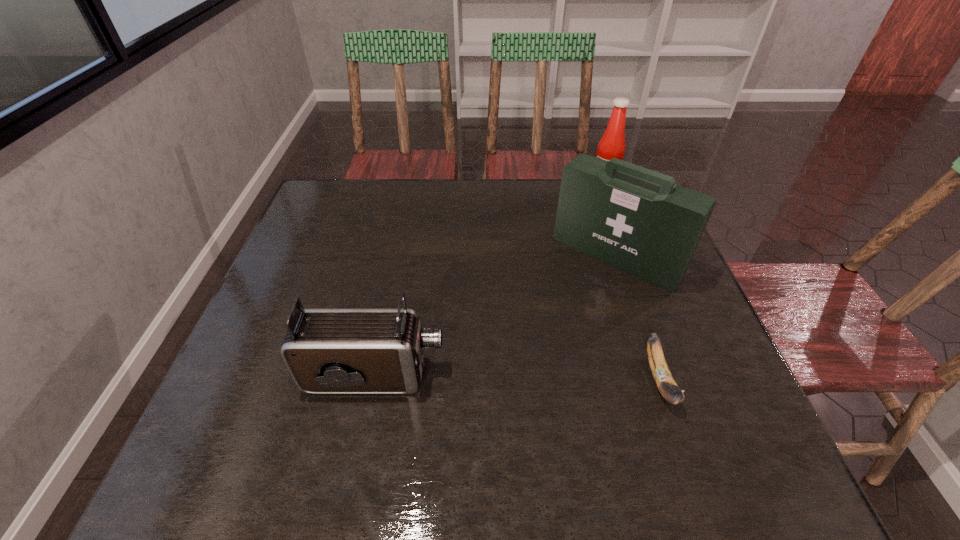
I want to click on free space located on the front-facing side of the condiment, so click(581, 242).

Image resolution: width=960 pixels, height=540 pixels. Identify the location of vacant space located 0.140m on the front-facing side of the condiment. (589, 219).

The width and height of the screenshot is (960, 540). I want to click on object at the far edge, so click(612, 144).

The width and height of the screenshot is (960, 540). I want to click on camcorder that is at the near edge, so click(x=327, y=351).

You are a GUI agent. You are given a task and a screenshot of the screen. Output one action in this format:
    pyautogui.click(x=<x>, y=<y>)
    Task: Click on the banana positioned at the near edge
    This screenshot has width=960, height=540.
    Given the screenshot: What is the action you would take?
    pyautogui.click(x=662, y=376)

Identify the location of object at the left edge. (327, 351).

The image size is (960, 540). Identify the location of banana that is at the right edge. (662, 376).

Locate an element on the screen. the first-aid kit located at the right edge is located at coordinates (635, 219).

Find the location of a particular element. The height and width of the screenshot is (540, 960). condiment located in the right edge section of the desktop is located at coordinates (612, 144).

At what (x,y) coordinates should I click in order to perform the action: click on object present at the near left corner. Please return your answer as a coordinate pair (x, y). Looking at the image, I should click on (327, 351).